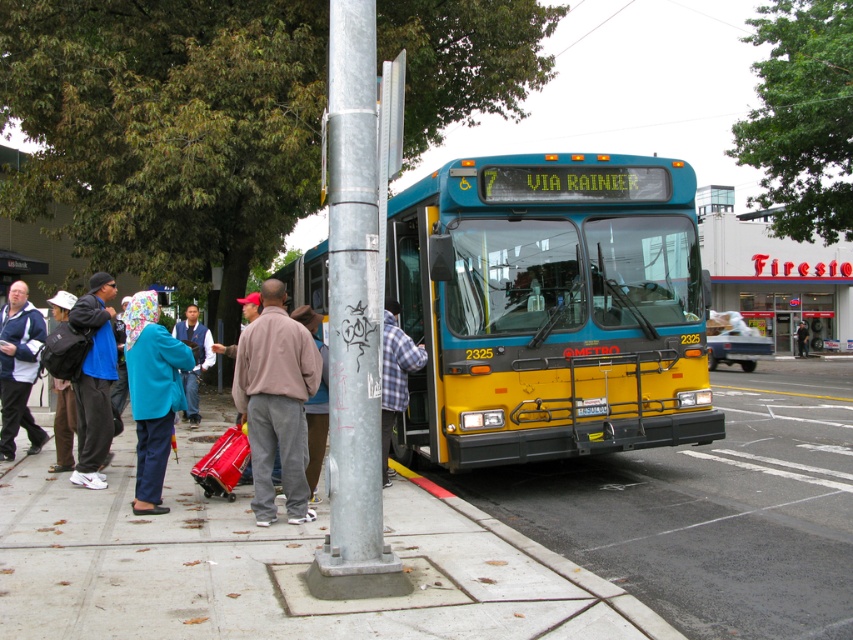
You are a pedestrian waiting at the bus stop and see two people wearing jackets at the center. Which jacket is closer to you, the blue fleece jacket at center or the blue fabric jacket at center?

The blue fleece jacket at center is closer to you since it is in front of the blue fabric jacket at center.

You are a delivery person carrying a large package and need to place it on the ground near the concrete at center and brown fleece jacket at center. Which object should you place the package next to to ensure it fits without overlapping?

The concrete at center has a smaller size compared to the brown fleece jacket at center, so you should place the package next to the brown fleece jacket at center to ensure it fits without overlapping.

You are a passenger waiting at the bus stop. You see two points marked on the ground where you need to stand. The first point is at point [155,349] and the second point is at point [180,371]. Which point should you stand on if you want to be closer to the bus that is stopped at the curb?

You should stand on point [155,349] because it is in front of point [180,371], meaning it is closer to the bus stopped at the curb.